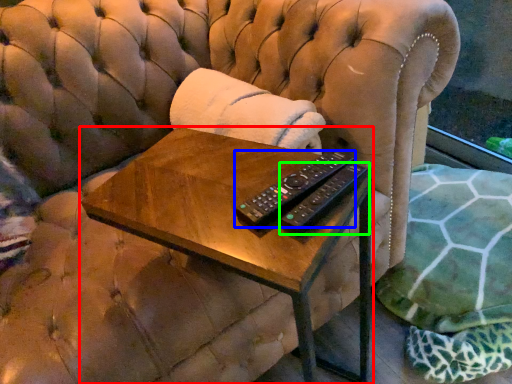
Question: Which object is positioned farthest from table (highlighted by a red box)? Select from remote control (highlighted by a blue box) and remote control (highlighted by a green box).

Choices:
 (A) remote control
 (B) remote control

Answer: (B)